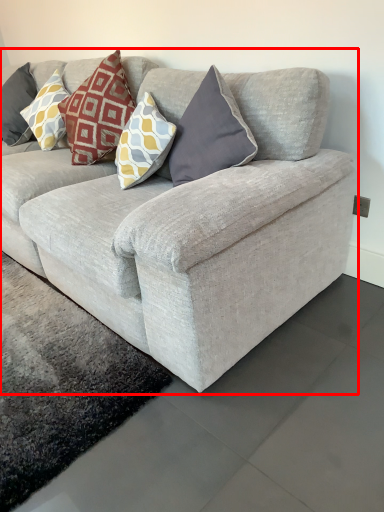
Question: From the image's perspective, where is studio couch (annotated by the red box) located relative to pillow?

Choices:
 (A) below
 (B) above

Answer: (A)